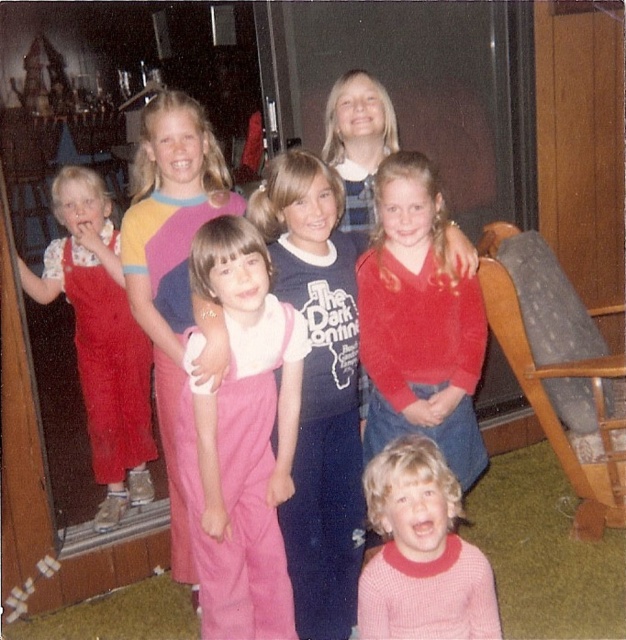
In the image of the family photograph, there are two points marked as point 1 at coordinate point [208,595] and point 2 at coordinate point [610,493]. Which point is closer to the viewer?

Point 1 at coordinate point [208,595] is closer to the viewer because it is in front of point 2 at coordinate point [610,493].

You are organizing a clothing donation drive and need to determine which item takes up more space in the donation box. Based on the image, which item is larger in size between the pink corduroy overalls at center and the pink knitted sweater at lower center?

The pink corduroy overalls at center has a larger size compared to the pink knitted sweater at lower center, so the pink corduroy overalls at center takes up more space in the donation box.